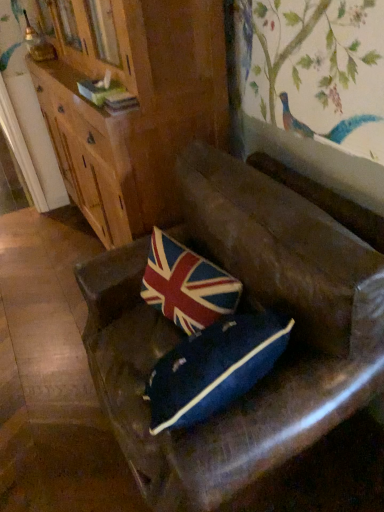
Question: Is leather couch at center thinner than union jack fabric pillow at center?

Choices:
 (A) no
 (B) yes

Answer: (A)

Question: Does leather couch at center have a lesser height compared to union jack fabric pillow at center?

Choices:
 (A) yes
 (B) no

Answer: (B)

Question: Considering the relative sizes of leather couch at center and union jack fabric pillow at center in the image provided, is leather couch at center taller than union jack fabric pillow at center?

Choices:
 (A) no
 (B) yes

Answer: (B)

Question: Could you tell me if leather couch at center is facing union jack fabric pillow at center?

Choices:
 (A) yes
 (B) no

Answer: (A)

Question: Is leather couch at center facing away from union jack fabric pillow at center?

Choices:
 (A) yes
 (B) no

Answer: (A)

Question: Would you say leather couch at center is to the left or to the right of union jack fabric pillow at center in the picture?

Choices:
 (A) left
 (B) right

Answer: (B)

Question: Would you say leather couch at center is inside or outside union jack fabric pillow at center?

Choices:
 (A) outside
 (B) inside

Answer: (A)

Question: From their relative heights in the image, would you say leather couch at center is taller or shorter than union jack fabric pillow at center?

Choices:
 (A) short
 (B) tall

Answer: (B)

Question: Based on their sizes in the image, would you say leather couch at center is bigger or smaller than union jack fabric pillow at center?

Choices:
 (A) small
 (B) big

Answer: (B)

Question: Considering the relative positions of wooden cabinet at upper left and leather couch at center in the image provided, is wooden cabinet at upper left to the left or to the right of leather couch at center?

Choices:
 (A) right
 (B) left

Answer: (B)

Question: Does point (82, 65) appear closer or farther from the camera than point (163, 434)?

Choices:
 (A) farther
 (B) closer

Answer: (A)

Question: In terms of width, does wooden cabinet at upper left look wider or thinner when compared to leather couch at center?

Choices:
 (A) wide
 (B) thin

Answer: (B)

Question: Is wooden cabinet at upper left taller or shorter than leather couch at center?

Choices:
 (A) short
 (B) tall

Answer: (B)

Question: From the image's perspective, is union jack fabric pillow at center above or below wooden cabinet at upper left?

Choices:
 (A) above
 (B) below

Answer: (B)

Question: In terms of size, does union jack fabric pillow at center appear bigger or smaller than wooden cabinet at upper left?

Choices:
 (A) small
 (B) big

Answer: (A)